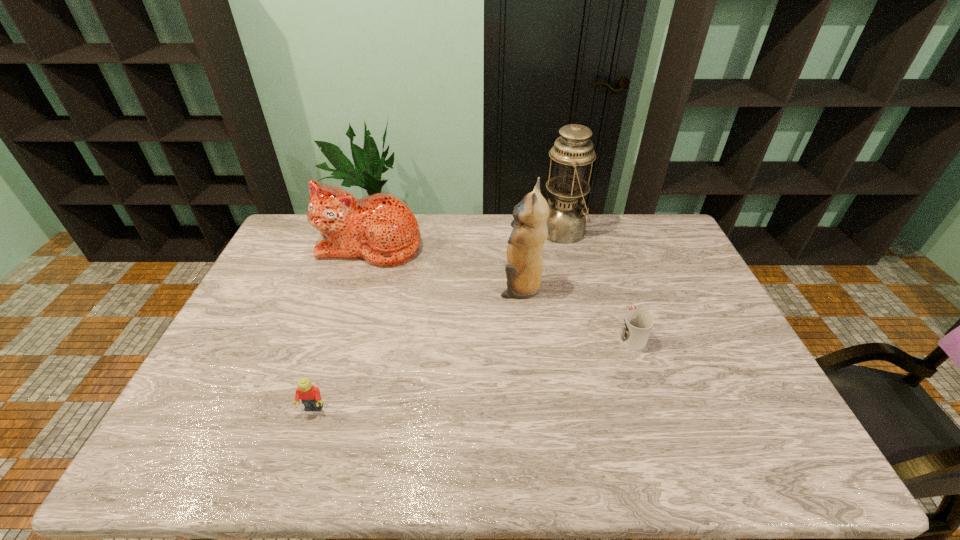
Where is `object present at the left edge`? object present at the left edge is located at coordinates (380, 228).

Find the location of `object at the far left corner`. object at the far left corner is located at coordinates [x=380, y=228].

Locate an element on the screen. This screenshot has height=540, width=960. vacant space at the near edge of the desktop is located at coordinates (569, 455).

In the image, there is a desktop. At what (x,y) coordinates should I click in order to perform the action: click on vacant area at the left edge. Please return your answer as a coordinate pair (x, y). Looking at the image, I should click on (289, 265).

The height and width of the screenshot is (540, 960). In order to click on vacant area at the right edge of the desktop in this screenshot , I will do `click(755, 407)`.

This screenshot has width=960, height=540. In the image, there is a desktop. Find the location of `vacant space at the far left corner`. vacant space at the far left corner is located at coordinates (294, 242).

This screenshot has height=540, width=960. In the image, there is a desktop. Find the location of `free region at the near left corner`. free region at the near left corner is located at coordinates (183, 437).

You are a GUI agent. You are given a task and a screenshot of the screen. Output one action in this format:
    pyautogui.click(x=<x>, y=<y>)
    Task: Click on the blank region between the oil lamp and the nearest object
    
    Given the screenshot: What is the action you would take?
    pyautogui.click(x=439, y=320)

You are a GUI agent. You are given a task and a screenshot of the screen. Output one action in this format:
    pyautogui.click(x=<x>, y=<y>)
    Task: Click on the free space between the nearer cat and the third tallest object
    The height and width of the screenshot is (540, 960).
    Given the screenshot: What is the action you would take?
    pyautogui.click(x=445, y=266)

The width and height of the screenshot is (960, 540). Identify the location of vacant region between the nearest object and the cup. (x=472, y=373).